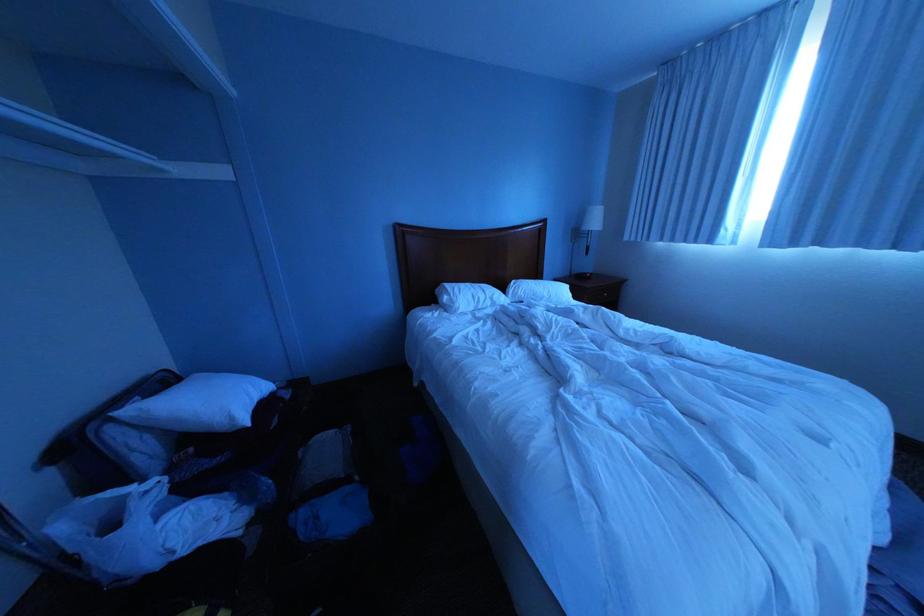
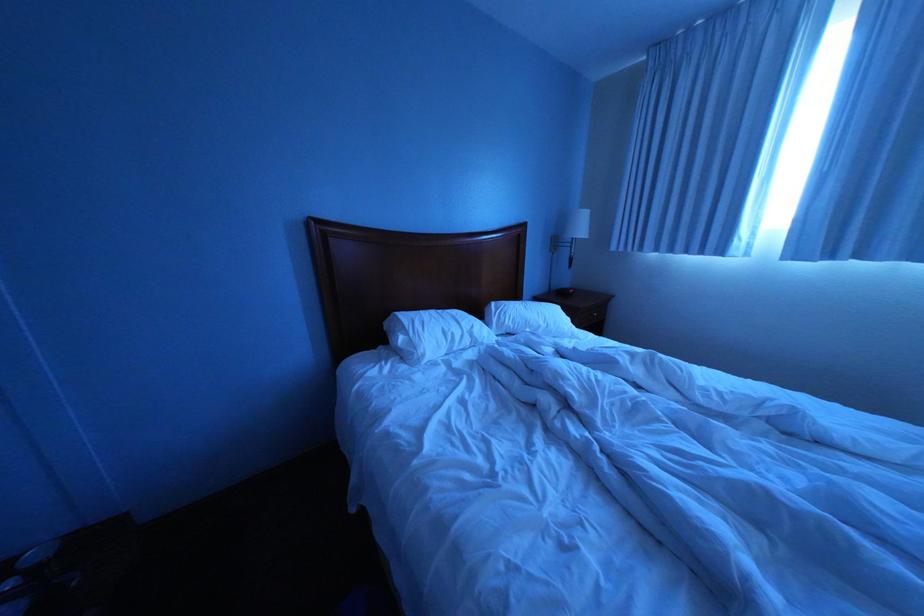
Question: Based on the continuous images, in which direction is the camera rotating? Reply with the corresponding letter.

Choices:
 (A) Left
 (B) Right
 (C) Up
 (D) Down

Answer: (B)